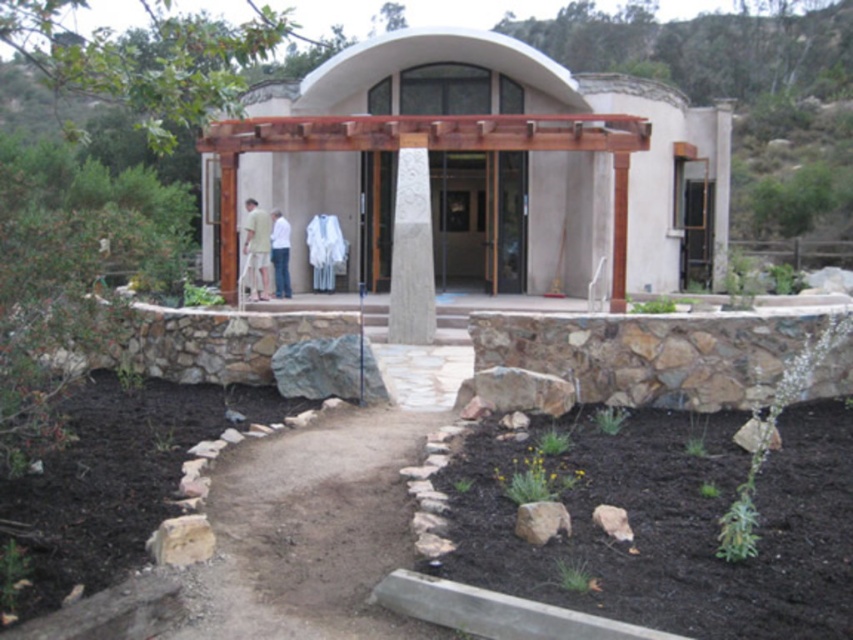
Question: Which object appears farthest from the camera in this image?

Choices:
 (A) light green fabric at center
 (B) white cotton shirt at center
 (C) brown rough rock at lower center
 (D) gray stone pillar at center

Answer: (B)

Question: Does gray rough rock at lower left appear on the right side of brown rough rock at lower center?

Choices:
 (A) yes
 (B) no

Answer: (B)

Question: Does gray rough rock at lower left have a lesser width compared to gray rock at lower right?

Choices:
 (A) yes
 (B) no

Answer: (B)

Question: Estimate the real-world distances between objects in this image. Which object is farther from the light green fabric at center?

Choices:
 (A) wooden pergola at center
 (B) brown rough rock at lower center
 (C) white cotton shirt at center
 (D) gray rough rock at lower left

Answer: (B)

Question: Which of the following is the farthest from the observer?

Choices:
 (A) wooden pergola at center
 (B) brown rough rock at lower center

Answer: (A)

Question: Does light green fabric at center appear over gray rock at lower right?

Choices:
 (A) yes
 (B) no

Answer: (A)